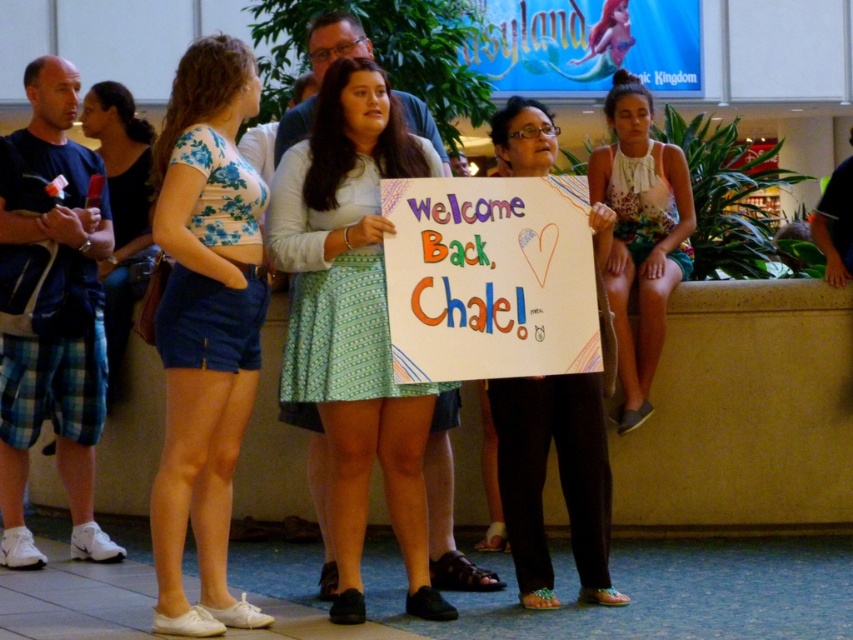
Question: Considering the real-world distances, which object is closest to the handwritten paper sign at center?

Choices:
 (A) floral dress at right
 (B) green printed skirt at center
 (C) matte white sign at center

Answer: (B)

Question: Among these points, which one is farthest from the camera?

Choices:
 (A) (167, 605)
 (B) (653, 317)
 (C) (515, 118)

Answer: (B)

Question: Among these points, which one is farthest from the camera?

Choices:
 (A) (173, 563)
 (B) (680, 257)
 (C) (576, 276)
 (D) (596, 504)

Answer: (B)

Question: From the image, what is the correct spatial relationship of handwritten paper sign at center in relation to floral dress at right?

Choices:
 (A) left
 (B) right

Answer: (A)

Question: Does blue floral crop top at center appear over matte white sign at center?

Choices:
 (A) yes
 (B) no

Answer: (A)

Question: Does green printed skirt at center appear over blue floral crop top at center?

Choices:
 (A) no
 (B) yes

Answer: (A)